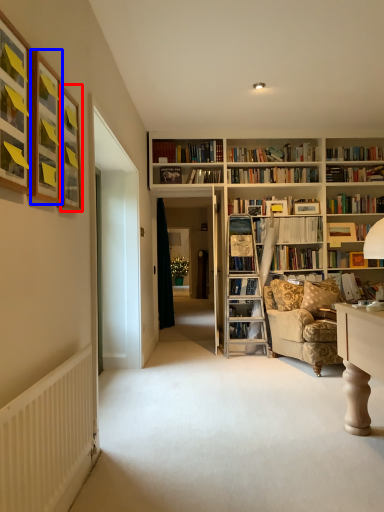
Question: Among these objects, which one is farthest to the camera, picture frame (highlighted by a red box) or picture frame (highlighted by a blue box)?

Choices:
 (A) picture frame
 (B) picture frame

Answer: (A)